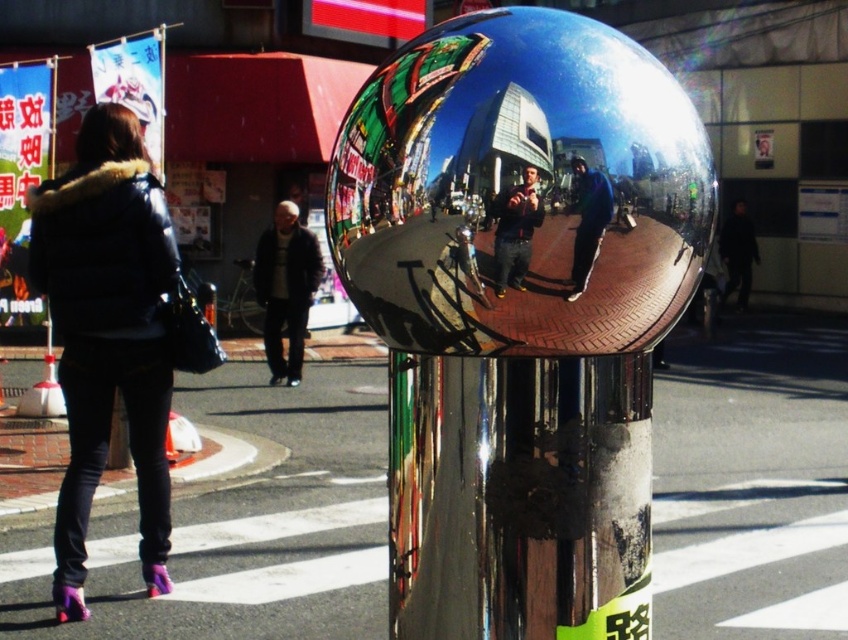
Question: Is matte black jacket at left bigger than dark blue jeans at center?

Choices:
 (A) no
 (B) yes

Answer: (B)

Question: Which point is closer to the camera?

Choices:
 (A) matte black jacket at left
 (B) dark blue jeans at center
 (C) dark gray fabric jacket at center
 (D) blue reflective jacket at center

Answer: (B)

Question: Can you confirm if dark gray fabric jacket at center is positioned below blue reflective jacket at center?

Choices:
 (A) no
 (B) yes

Answer: (A)

Question: Which of the following is the closest to the observer?

Choices:
 (A) (592, 186)
 (B) (514, 276)
 (C) (286, 372)
 (D) (106, 310)

Answer: (A)

Question: Observing the image, what is the correct spatial positioning of dark gray fabric jacket at center in reference to blue reflective jacket at center?

Choices:
 (A) above
 (B) below

Answer: (A)

Question: Considering the real-world distances, which object is closest to the dark blue jeans at center?

Choices:
 (A) dark gray fabric jacket at center
 (B) blue reflective jacket at center

Answer: (B)